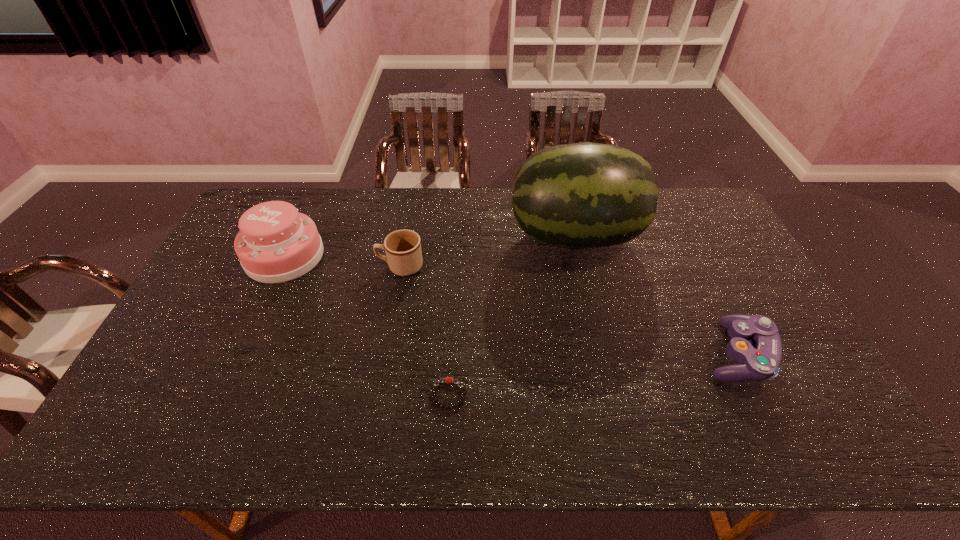
I want to click on the tallest object, so click(582, 195).

Locate an element on the screen. watermelon is located at coordinates (582, 195).

I want to click on the second tallest object, so click(275, 244).

Locate an element on the screen. This screenshot has width=960, height=540. the leftmost object is located at coordinates (275, 244).

What are the coordinates of `the fourth object from right to left` in the screenshot? It's located at click(x=403, y=251).

Where is `the rightmost object`? Image resolution: width=960 pixels, height=540 pixels. the rightmost object is located at coordinates (759, 360).

I want to click on bracelet, so [x=448, y=379].

Where is `the shortest object`? the shortest object is located at coordinates (448, 379).

Where is `vacant area situated 0.120m on the back of the watermelon`? The width and height of the screenshot is (960, 540). vacant area situated 0.120m on the back of the watermelon is located at coordinates (564, 188).

Find the location of a particular element. The width and height of the screenshot is (960, 540). free location located on the right of the second tallest object is located at coordinates (360, 256).